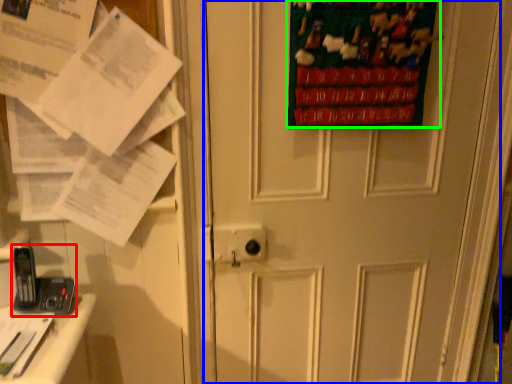
Question: Which is farther away from equipment (highlighted by a red box)? door (highlighted by a blue box) or poster page (highlighted by a green box)?

Choices:
 (A) door
 (B) poster page

Answer: (B)